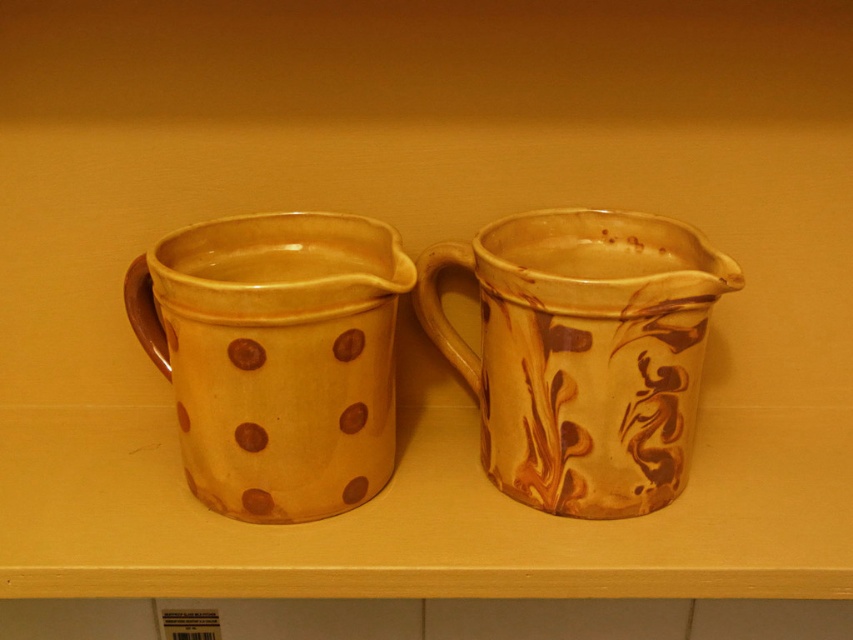
You are setting up a small tea station and need to place both the matte yellow clay mug at left and the marbled clay pitcher at right on a shelf that can only accommodate items up to 12 inches in width. Based on the description, can you determine if both items will fit side by side?

The matte yellow clay mug at left might be wider than the marbled clay pitcher at right, so it is uncertain if both will fit within the 12 inch width limit. Measure both items to confirm their combined width before placing them on the shelf.

Consider the image. You are standing 26.47 inches away from the point at the coordinates (196,342). Can you reach the point without moving your feet?

The distance between you and the point at (196,342) is 26.47 inches, which is within typical human reaching distance. Assuming an average reach of about 28 inches, you can likely reach the point without moving your feet.

You are standing in front of the shelf with two pitchers. There are two points marked on the shelf. One is at coordinates point (283, 452) and the other is at point (596, 504). Which point is closer to you?

Point (283, 452) is closer to the viewer than point (596, 504).